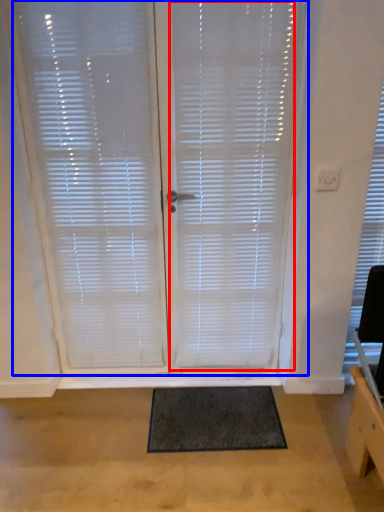
Question: Which point is closer to the camera, blind (highlighted by a red box) or window blind (highlighted by a blue box)?

Choices:
 (A) blind
 (B) window blind

Answer: (A)